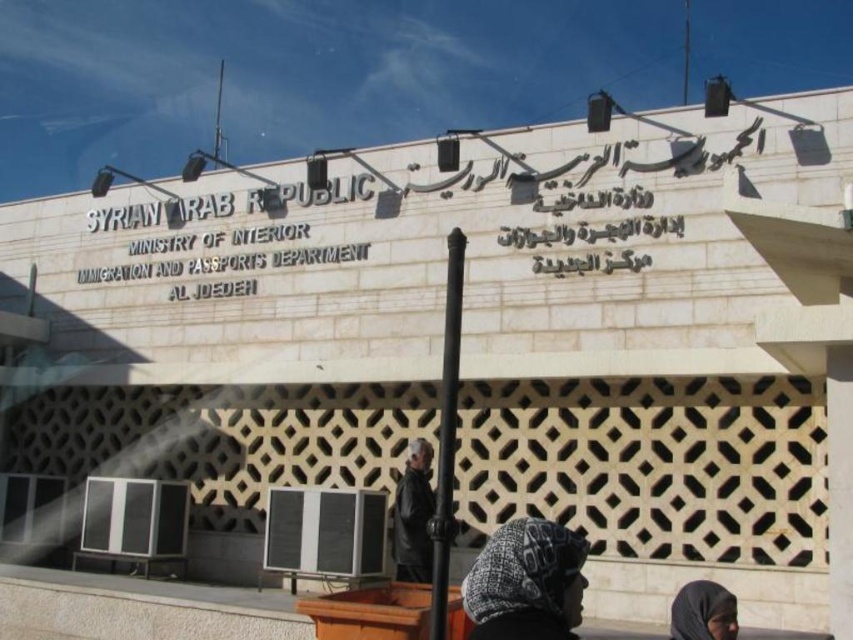
You are a photographer planning to take a portrait of two people standing in front of the Ministry of Interior building. You have a camera with a limited field of view. Given that the knitted woolen hat at lower center and the black fabric headscarf at lower right are part of their attire, which headwear item will appear larger in your photo?

The knitted woolen hat at lower center will appear larger in the photo because it is bigger than the black fabric headscarf at lower right.

You are standing at the entrance of the Ministry of Interior in Al Jdeideh, Syria. You have a knitted woolen hat at lower center and a camera. Which object is closer to you?

The knitted woolen hat at lower center and camera are 67.97 feet apart from each other, so the knitted woolen hat at lower center is closer to you since it is at lower center compared to the camera which is not specified in the scene description.

You are standing in front of the government building and see both the knitted woolen hat at lower center and the black fabric headscarf at lower right. Which object is positioned to the left when viewed from your perspective?

The knitted woolen hat at lower center is positioned to the left of the black fabric headscarf at lower right.